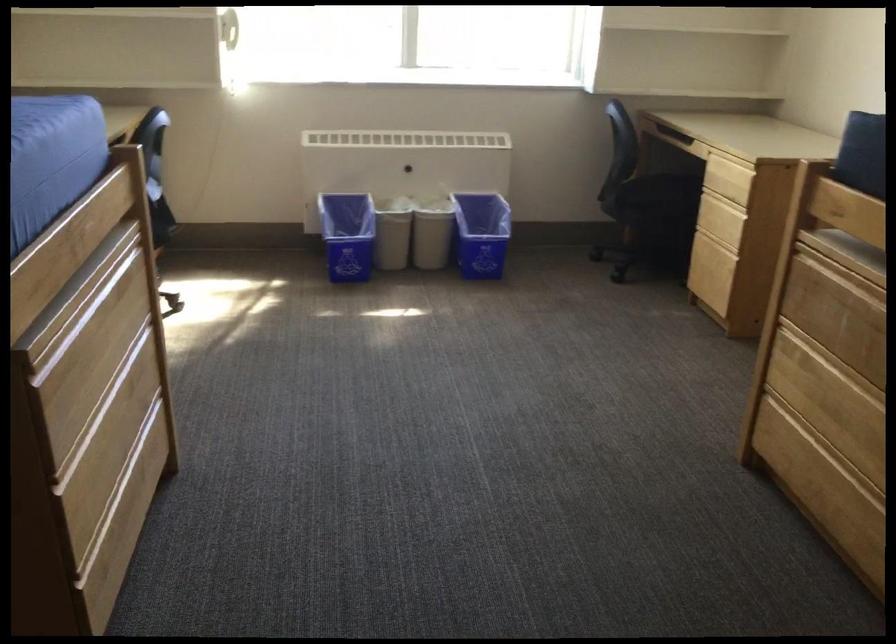
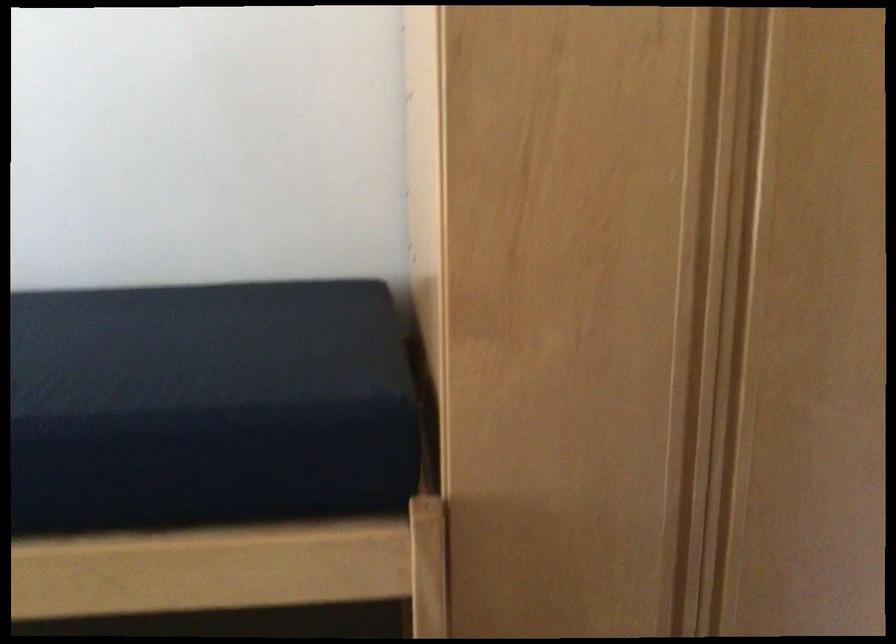
Question: The first image is from the beginning of the video and the second image is from the end. How did the camera likely rotate when shooting the video?

Choices:
 (A) Left
 (B) Right
 (C) Up
 (D) Down

Answer: (B)